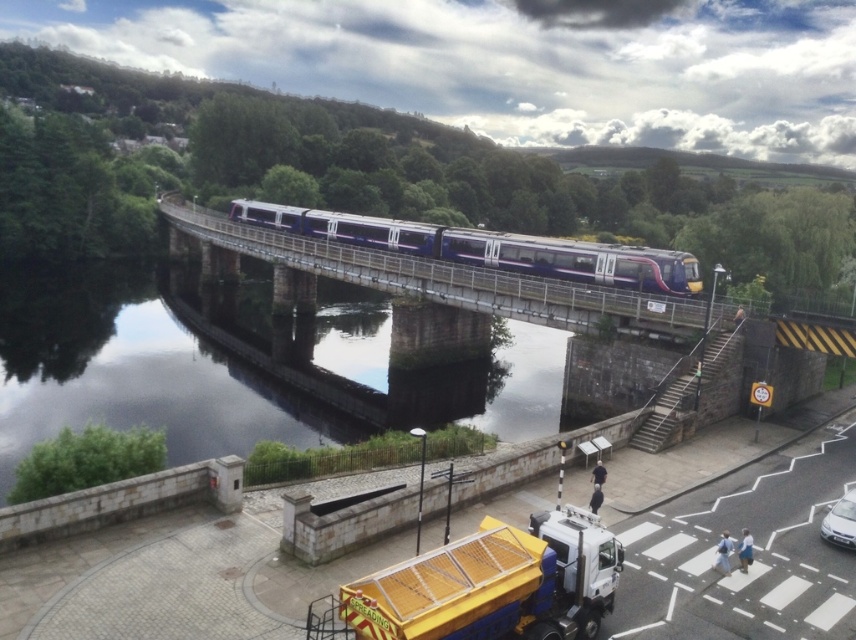
You are a drone operator trying to capture a photo of the yellow mesh truck at lower center while avoiding the dark reflective water at center. Given that your drone can only hover 50 meters away from the truck, will you be able to avoid the water?

The dark reflective water at center and yellow mesh truck at lower center are 57.24 meters apart from each other. Since the drone can only hover 50 meters away from the truck, it cannot reach the distance needed to avoid the water. Therefore, the drone will still be too close to the water and might not avoid it.

You are a photographer standing at the edge of the river, aiming to capture the reflection of the train on the dark reflective water at center. According to the coordinates provided, where should you position your camera to ensure the reflection is centered in your shot?

The dark reflective water at center is located at coordinates point (x=134, y=371), so you should position your camera directly above or aligned with this point to capture the reflection centered in your shot.

You are a photographer planning to take a photo of the silver metallic car at lower right and the dark reflective water at center. Which object should you position closer to the left side of your camera frame?

The dark reflective water at center should be positioned closer to the left side of your camera frame because it is located to the left of the silver metallic car at lower right.